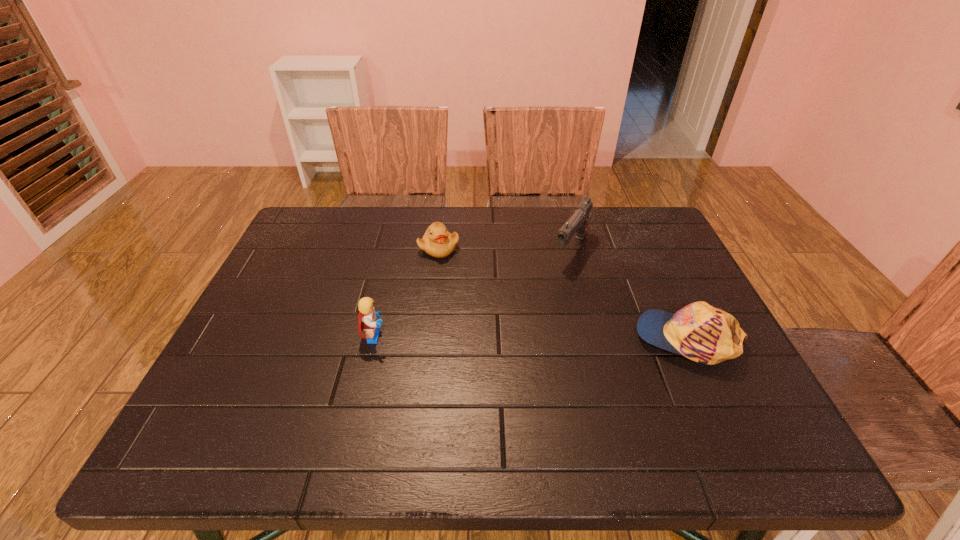
Where is `vacant area that lies between the cap and the second object from right to left`? vacant area that lies between the cap and the second object from right to left is located at coordinates (630, 294).

Where is `empty space between the Lego and the duckling`? The width and height of the screenshot is (960, 540). empty space between the Lego and the duckling is located at coordinates 407,292.

Find the location of a particular element. free point between the duckling and the cap is located at coordinates (564, 293).

The height and width of the screenshot is (540, 960). Identify the location of free space that is in between the second object from left to right and the rightmost object. (564, 293).

I want to click on object that ranks as the second closest to the leftmost object, so (x=578, y=222).

Locate an element on the screen. The width and height of the screenshot is (960, 540). object that is the closest to the third object from left to right is located at coordinates (705, 334).

Identify the location of free location that satisfies the following two spatial constraints: 1. on the front side of the rightmost object; 2. on the bill of the gun. This screenshot has width=960, height=540. (594, 339).

Locate an element on the screen. vacant space that satisfies the following two spatial constraints: 1. on the front side of the cap; 2. on the bill of the duckling is located at coordinates (428, 339).